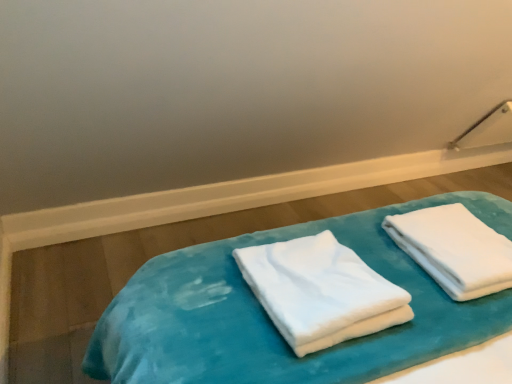
Question: From the image's perspective, is white soft towel at center, the first towel when ordered from left to right, on top of velvet blue bed at center?

Choices:
 (A) yes
 (B) no

Answer: (B)

Question: Is white soft towel at center, which is the second towel in right-to-left order, behind velvet blue bed at center?

Choices:
 (A) yes
 (B) no

Answer: (B)

Question: Is white soft towel at center, the first towel when ordered from left to right, positioned beyond the bounds of velvet blue bed at center?

Choices:
 (A) no
 (B) yes

Answer: (B)

Question: Does white soft towel at center, which is the second towel in right-to-left order, have a greater width compared to velvet blue bed at center?

Choices:
 (A) no
 (B) yes

Answer: (A)

Question: Is white soft towel at center, which is the second towel in right-to-left order, taller than velvet blue bed at center?

Choices:
 (A) no
 (B) yes

Answer: (B)

Question: From a real-world perspective, is white soft towel at center, which is the second towel in right-to-left order, beneath velvet blue bed at center?

Choices:
 (A) no
 (B) yes

Answer: (A)

Question: Is white soft towel at right, acting as the 1th towel starting from the right, turned away from white soft towel at center, which is the second towel in right-to-left order?

Choices:
 (A) no
 (B) yes

Answer: (A)

Question: Can you confirm if white soft towel at right, placed as the 2th towel when sorted from left to right, is positioned to the left of white soft towel at center, the first towel when ordered from left to right?

Choices:
 (A) yes
 (B) no

Answer: (B)

Question: Could white soft towel at center, which is the second towel in right-to-left order, be considered to be inside white soft towel at right, acting as the 1th towel starting from the right?

Choices:
 (A) yes
 (B) no

Answer: (B)

Question: Is white soft towel at right, placed as the 2th towel when sorted from left to right, at the right side of white soft towel at center, which is the second towel in right-to-left order?

Choices:
 (A) yes
 (B) no

Answer: (A)

Question: Can you see white soft towel at right, acting as the 1th towel starting from the right, touching white soft towel at center, the first towel when ordered from left to right?

Choices:
 (A) yes
 (B) no

Answer: (B)

Question: Does white soft towel at right, placed as the 2th towel when sorted from left to right, have a greater height compared to white soft towel at center, the first towel when ordered from left to right?

Choices:
 (A) yes
 (B) no

Answer: (B)

Question: Is velvet blue bed at center thinner than white soft towel at right, acting as the 1th towel starting from the right?

Choices:
 (A) yes
 (B) no

Answer: (B)